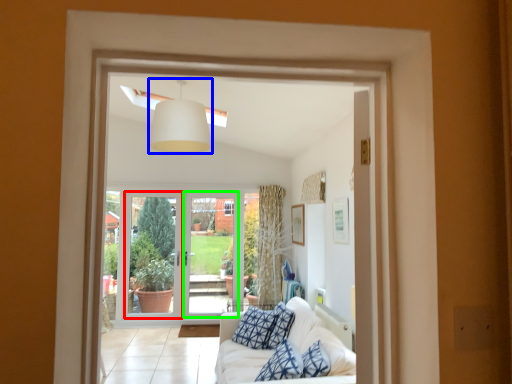
Question: Considering the real-world distances, which object is farthest from screen door (highlighted by a red box)? light fixture (highlighted by a blue box) or screen door (highlighted by a green box)?

Choices:
 (A) light fixture
 (B) screen door

Answer: (A)